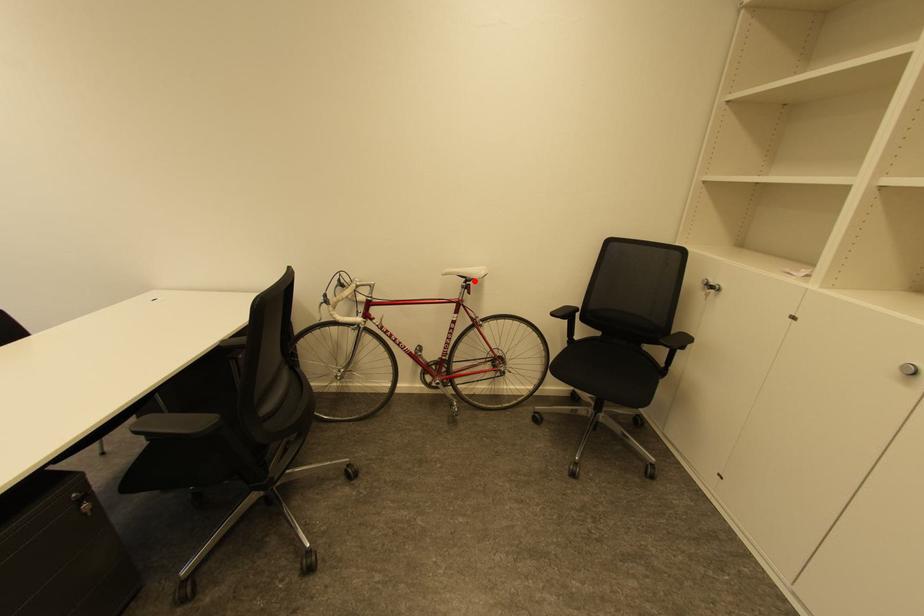
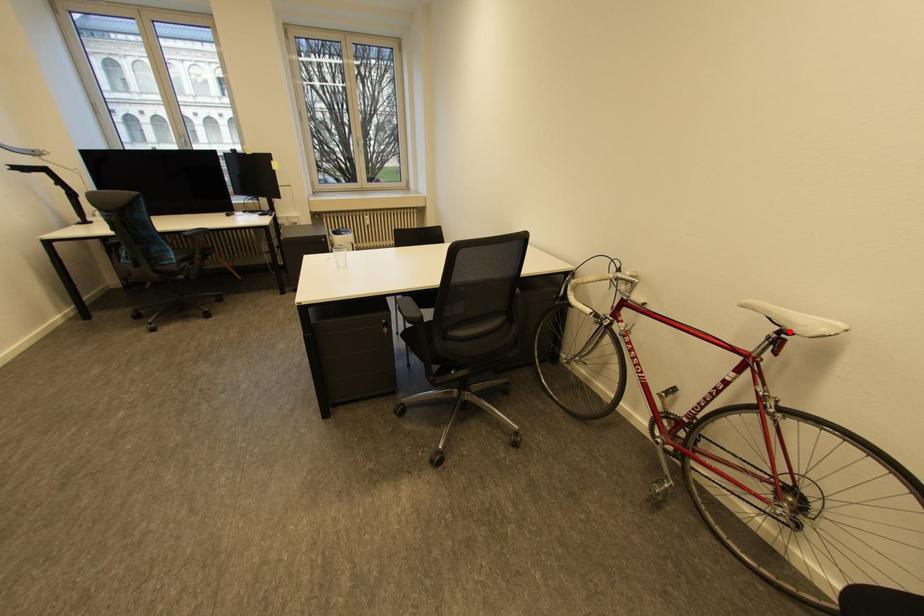
I am providing you with two images of the same scene from different viewpoints. A red point is marked on the first image and another point is marked on the second image. Is the marked point in image1 the same physical position as the marked point in image2?

Yes